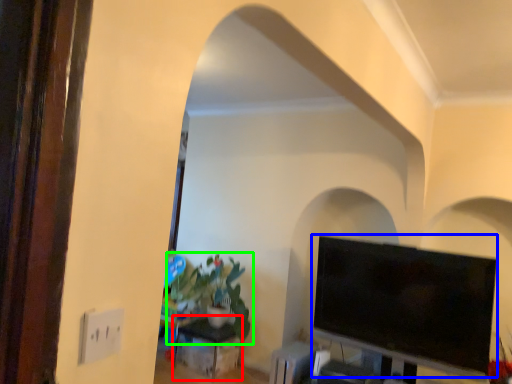
Question: Which object is the closest to the table (highlighted by a red box)? Choose among these: television (highlighted by a blue box) or houseplant (highlighted by a green box).

Choices:
 (A) television
 (B) houseplant

Answer: (B)